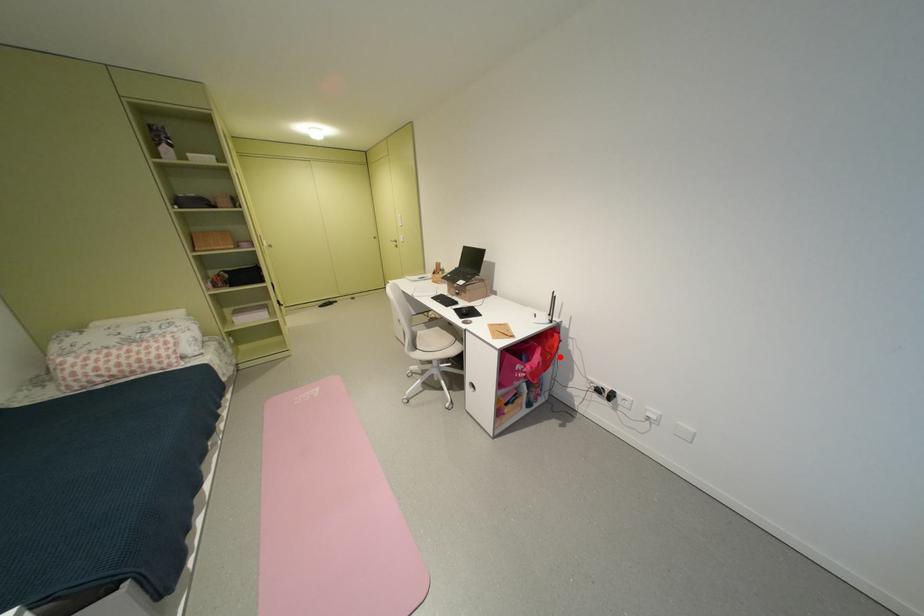
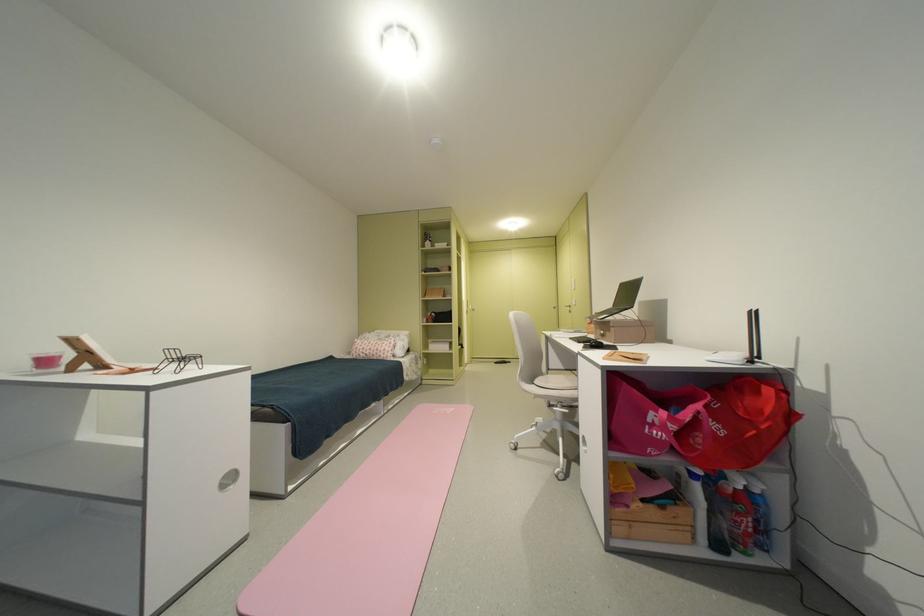
In the second image, find the point that corresponds to the highlighted location in the first image.

(764, 434)